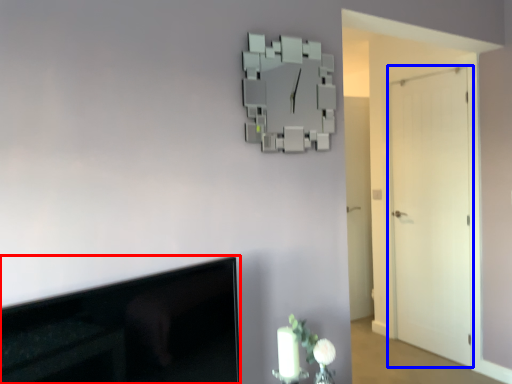
Question: Which point is further to the camera, television (highlighted by a red box) or door (highlighted by a blue box)?

Choices:
 (A) television
 (B) door

Answer: (B)